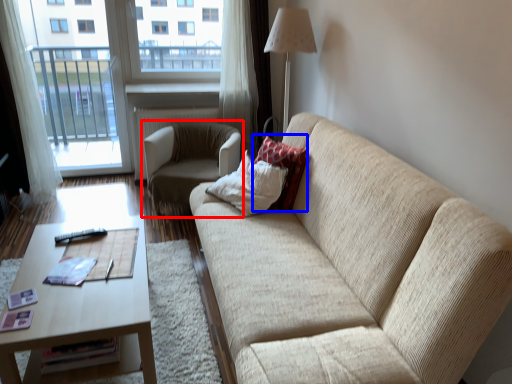
Question: Which of the following is the farthest to the observer, chair (highlighted by a red box) or pillow (highlighted by a blue box)?

Choices:
 (A) chair
 (B) pillow

Answer: (A)